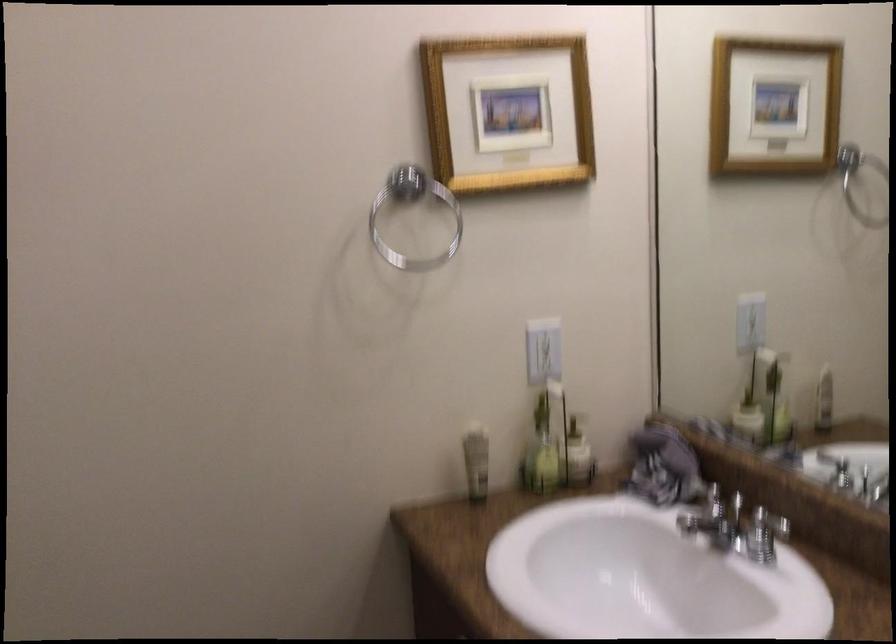
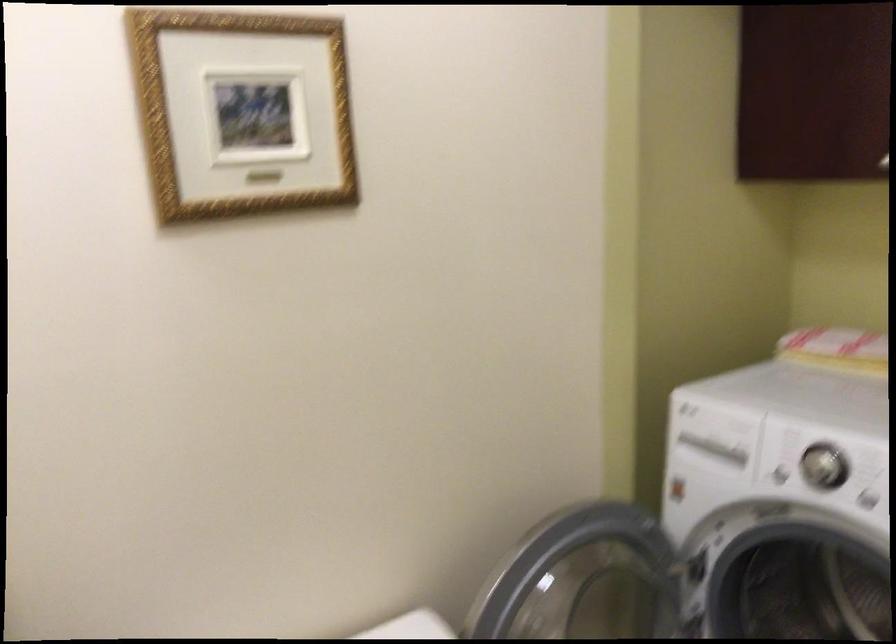
Question: The camera is either moving clockwise (left) or counter-clockwise (right) around the object. The first image is from the beginning of the video and the second image is from the end. Is the camera moving left or right when shooting the video?

Choices:
 (A) Left
 (B) Right

Answer: (A)